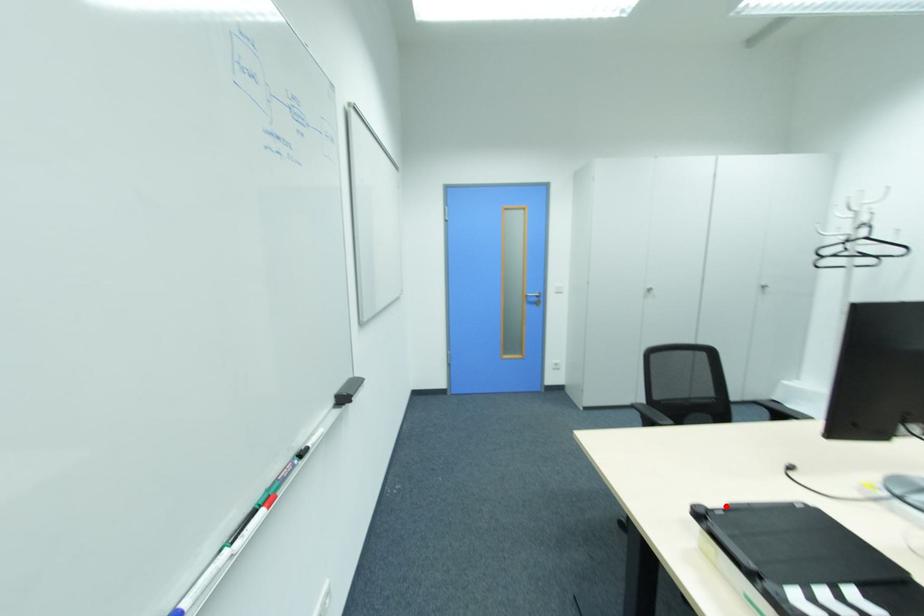
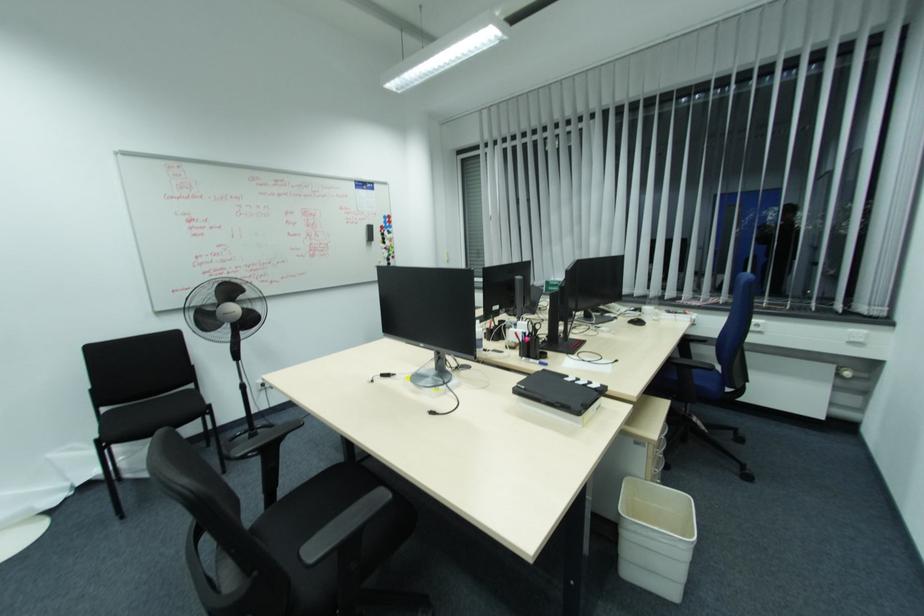
The point at the highlighted location is marked in the first image. Where is the corresponding point in the second image?

(560, 403)